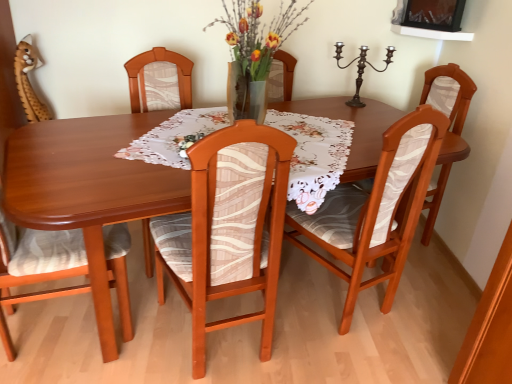
The image size is (512, 384). Find the location of `vacant space underneath wooden chair at center, the 2th chair viewed from the right (from a real-world perspective)`. vacant space underneath wooden chair at center, the 2th chair viewed from the right (from a real-world perspective) is located at coordinates (331, 298).